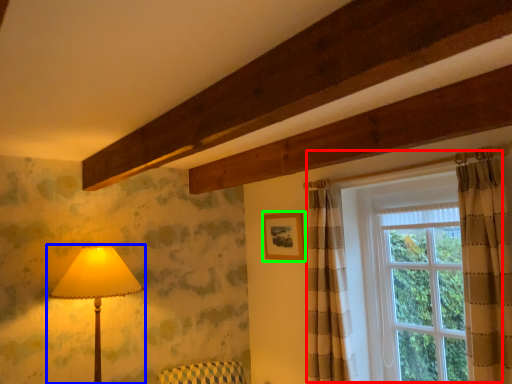
Question: Which object is positioned closest to window (highlighted by a red box)? Select from lamp (highlighted by a blue box) and picture frame (highlighted by a green box).

Choices:
 (A) lamp
 (B) picture frame

Answer: (B)